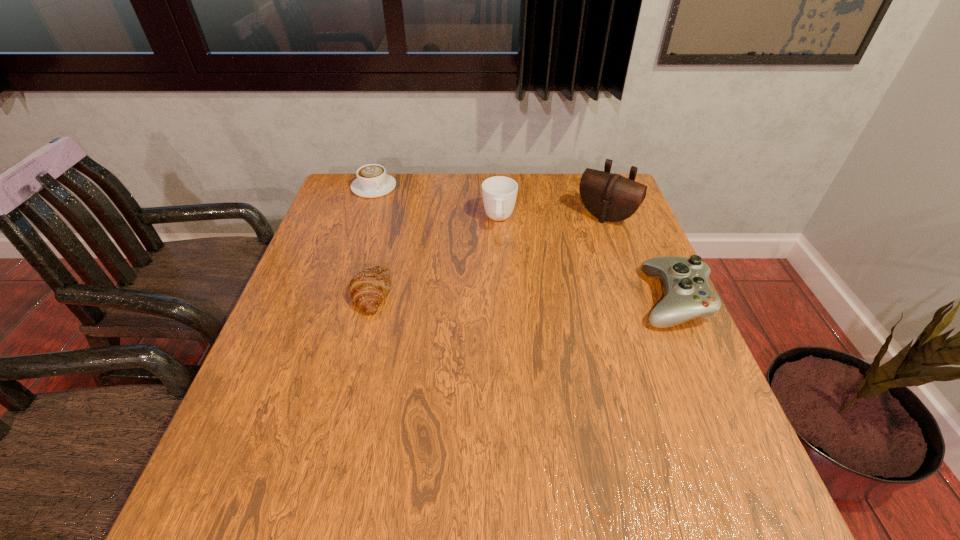
Image resolution: width=960 pixels, height=540 pixels. Find the location of `free space at the near right corner of the desktop`. free space at the near right corner of the desktop is located at coordinates (720, 454).

Where is `vacant space that's between the third object from left to right and the pouch`? vacant space that's between the third object from left to right and the pouch is located at coordinates (553, 218).

Where is `vacant space that's between the tallest object and the third object from right to left`? The height and width of the screenshot is (540, 960). vacant space that's between the tallest object and the third object from right to left is located at coordinates (553, 218).

The height and width of the screenshot is (540, 960). I want to click on free space between the tallest object and the third shortest object, so click(x=639, y=258).

Identify the location of unoccupied position between the third tallest object and the third object from left to right. (586, 259).

Image resolution: width=960 pixels, height=540 pixels. What are the coordinates of `free area in between the cappuccino and the third shortest object` in the screenshot? It's located at 523,243.

You are a GUI agent. You are given a task and a screenshot of the screen. Output one action in this format:
    pyautogui.click(x=<x>, y=<y>)
    Task: Click on the empty space that is in between the crescent roll and the third object from right to left
    This screenshot has height=540, width=960.
    Given the screenshot: What is the action you would take?
    pyautogui.click(x=435, y=256)

Identify the location of empty location between the crescent roll and the third tallest object. This screenshot has width=960, height=540. (521, 295).

You are a GUI agent. You are given a task and a screenshot of the screen. Output one action in this format:
    pyautogui.click(x=<x>, y=<y>)
    Task: Click on the free space between the third object from left to right and the crescent roll
    The image size is (960, 540).
    Given the screenshot: What is the action you would take?
    pyautogui.click(x=435, y=256)

Locate an element on the screen. This screenshot has width=960, height=540. empty location between the crescent roll and the third object from left to right is located at coordinates (435, 256).